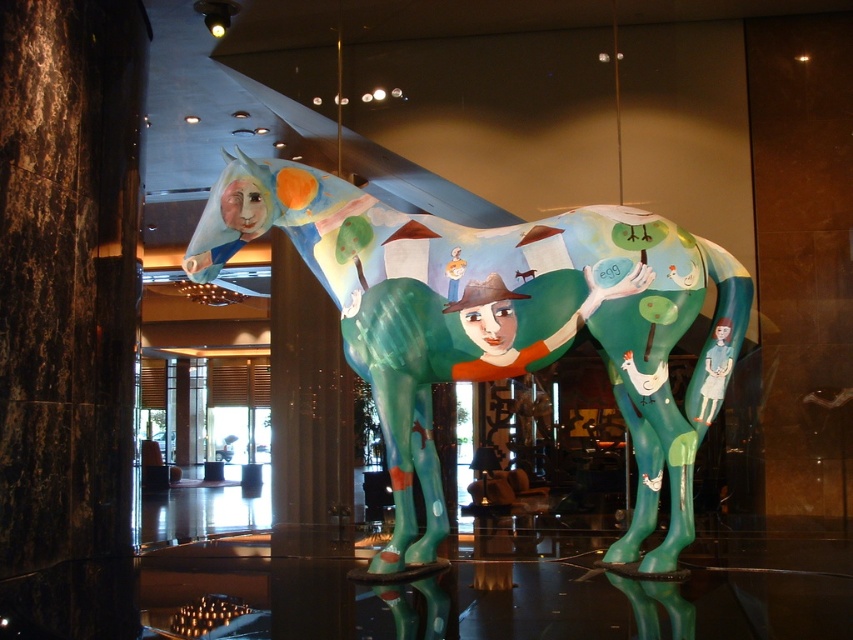
Is shiny painted horse at center positioned behind black polished stone pillar at center?

No.

Is point (554, 230) in front of point (289, 621)?

No, (554, 230) is further to viewer.

What do you see at coordinates (498, 323) in the screenshot? Image resolution: width=853 pixels, height=640 pixels. I see `shiny painted horse at center` at bounding box center [498, 323].

Locate an element on the screen. The height and width of the screenshot is (640, 853). shiny painted horse at center is located at coordinates (498, 323).